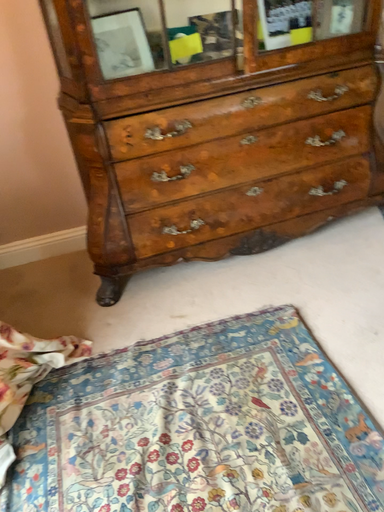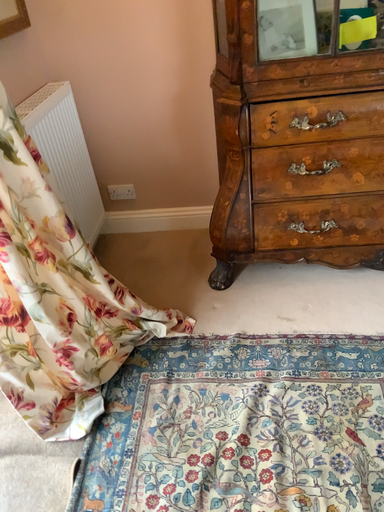
Question: How did the camera likely rotate when shooting the video?

Choices:
 (A) rotated left
 (B) rotated right

Answer: (A)